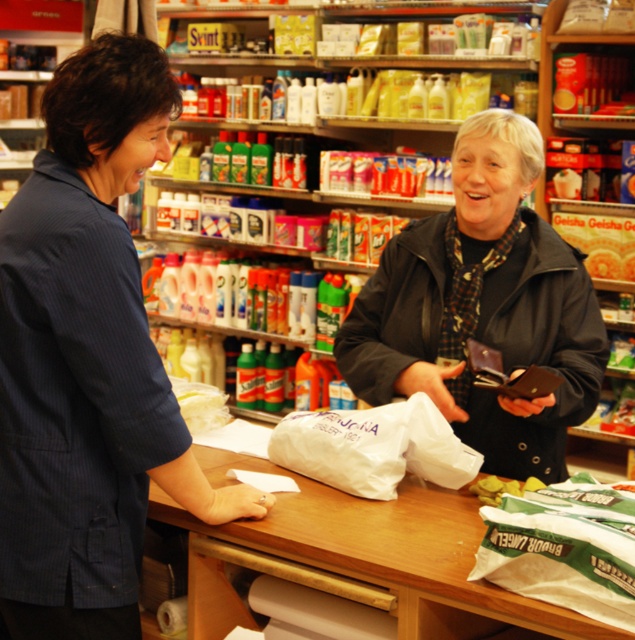
Is blue striped shirt at left closer to the viewer compared to white matte grocery bag at center?

Yes, blue striped shirt at left is in front of white matte grocery bag at center.

Describe the element at coordinates (88, 360) in the screenshot. I see `blue striped shirt at left` at that location.

Who is more distant from viewer, (117, 269) or (305, 422)?

The point (305, 422) is behind.

You are a GUI agent. You are given a task and a screenshot of the screen. Output one action in this format:
    pyautogui.click(x=<x>, y=<y>)
    Task: Click on the blue striped shirt at left
    The height and width of the screenshot is (640, 635).
    Given the screenshot: What is the action you would take?
    pyautogui.click(x=88, y=360)

Is blue striped shirt at left to the left of dark blue jacket at center from the viewer's perspective?

Indeed, blue striped shirt at left is positioned on the left side of dark blue jacket at center.

Who is positioned more to the left, blue striped shirt at left or dark blue jacket at center?

From the viewer's perspective, blue striped shirt at left appears more on the left side.

Looking at this image, measure the distance between point (x=128, y=76) and camera.

5.09 feet

What are the coordinates of `blue striped shirt at left` in the screenshot? It's located at [88, 360].

Is point (530, 154) positioned in front of point (418, 420)?

No, it is not.

Can you confirm if dark blue jacket at center is wider than white matte grocery bag at center?

Correct, the width of dark blue jacket at center exceeds that of white matte grocery bag at center.

Which is behind, point (572, 266) or point (295, 422)?

Positioned behind is point (572, 266).

Where is `dark blue jacket at center`? This screenshot has width=635, height=640. dark blue jacket at center is located at coordinates (483, 307).